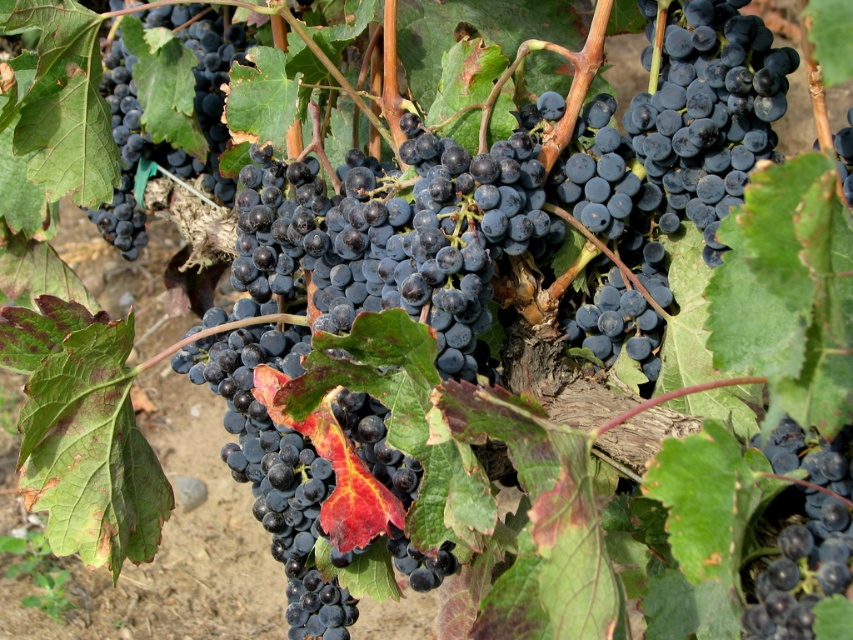
Question: Can you confirm if shiny dark blue grapes at upper left is smaller than shiny dark blue grape at center?

Choices:
 (A) yes
 (B) no

Answer: (B)

Question: Considering the real-world distances, which object is farthest from the shiny dark blue grapes at center?

Choices:
 (A) shiny dark blue grapes at upper left
 (B) shiny dark blue grape at center

Answer: (A)

Question: Is shiny dark blue grapes at center bigger than shiny dark blue grape at center?

Choices:
 (A) no
 (B) yes

Answer: (A)

Question: Which point appears farthest from the camera in this image?

Choices:
 (A) (799, 588)
 (B) (202, 134)

Answer: (B)

Question: Which is farther from the shiny dark blue grapes at upper left?

Choices:
 (A) shiny dark blue grape at center
 (B) shiny dark blue grapes at center

Answer: (B)

Question: Does shiny dark blue grapes at upper left have a greater width compared to shiny dark blue grape at center?

Choices:
 (A) yes
 (B) no

Answer: (A)